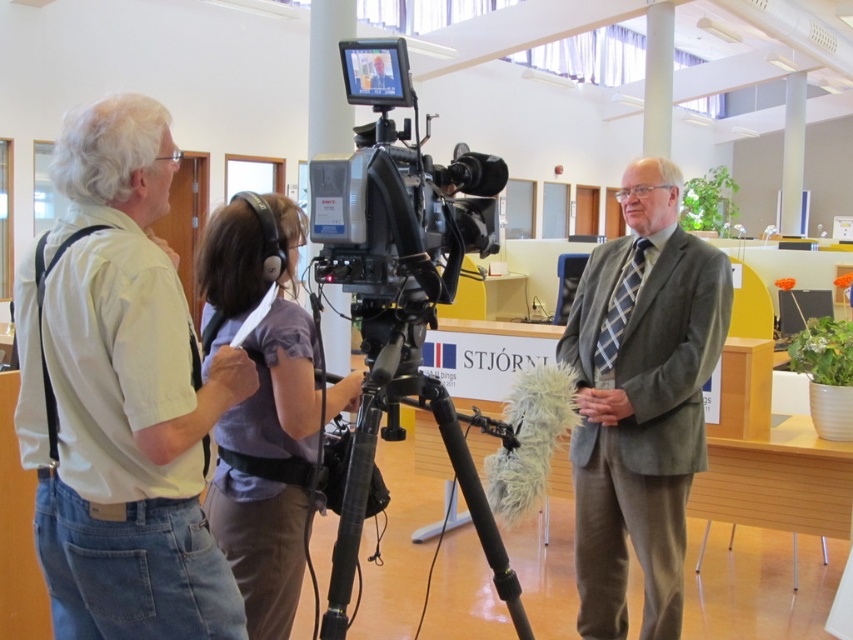
Question: Which of the following is the farthest from the observer?

Choices:
 (A) matte purple shirt at center
 (B) gray wool suit at center
 (C) light beige shirt at left

Answer: (B)

Question: Considering the relative positions of black plastic video camera at center and black metal tripod at center in the image provided, where is black plastic video camera at center located with respect to black metal tripod at center?

Choices:
 (A) right
 (B) left

Answer: (A)

Question: Is matte purple shirt at center bigger than black plastic video camera at center?

Choices:
 (A) yes
 (B) no

Answer: (A)

Question: Estimate the real-world distances between objects in this image. Which object is farther from the black metal tripod at center?

Choices:
 (A) gray wool suit at center
 (B) black plastic video camera at center
 (C) light beige shirt at left

Answer: (A)

Question: Can you confirm if gray wool suit at center is positioned to the right of black plastic video camera at center?

Choices:
 (A) yes
 (B) no

Answer: (A)

Question: Which point appears closest to the camera in this image?

Choices:
 (A) (410, 202)
 (B) (393, 388)

Answer: (A)